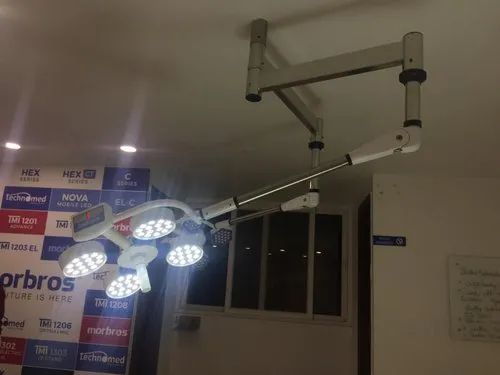
Image resolution: width=500 pixels, height=375 pixels. Find the location of `wall`. wall is located at coordinates (290, 345).